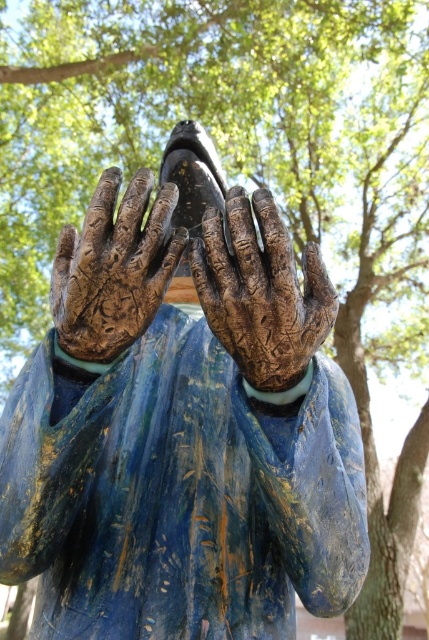
You are standing in front of a statue and see the point marked at coordinates (260, 292). What part of the statue does this point correspond to?

The point at (260, 292) corresponds to the rusty metal hand at center.